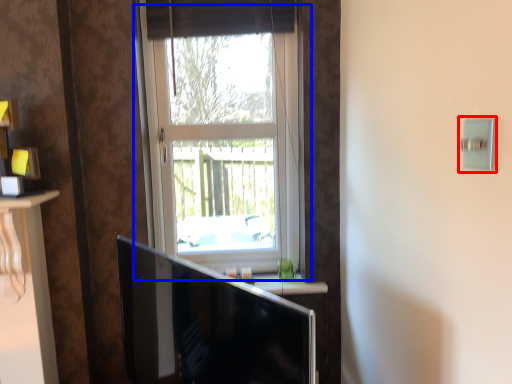
Question: Which object is further to the camera taking this photo, light switch (highlighted by a red box) or window (highlighted by a blue box)?

Choices:
 (A) light switch
 (B) window

Answer: (B)